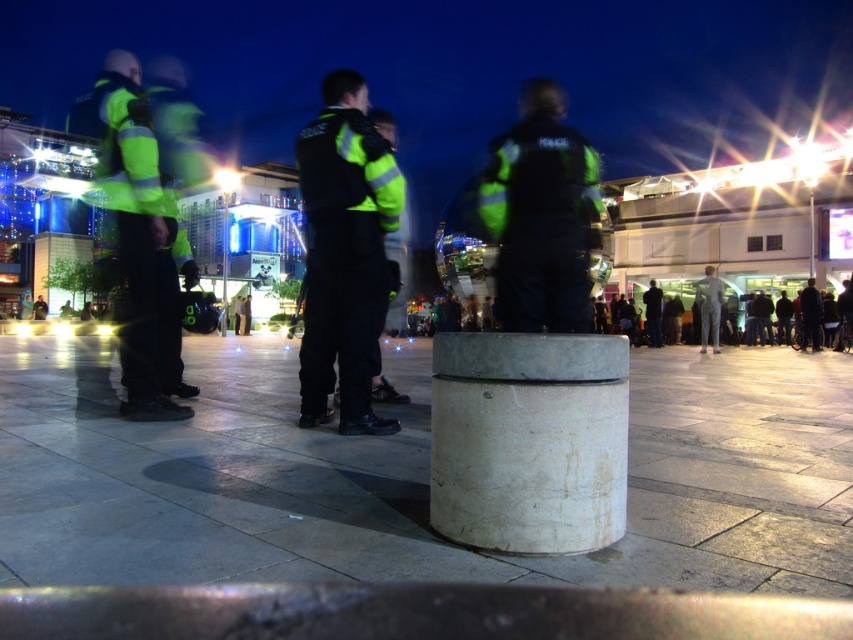
Question: Can you confirm if white marble pillar at center is positioned below high-visibility reflective jacket at left?

Choices:
 (A) yes
 (B) no

Answer: (A)

Question: From the image, what is the correct spatial relationship of high-visibility reflective jacket at center in relation to high-visibility reflective jacket at left?

Choices:
 (A) right
 (B) left

Answer: (A)

Question: Which of the following is the farthest from the observer?

Choices:
 (A) (432, 509)
 (B) (132, 289)
 (C) (315, 248)
 (D) (529, 84)

Answer: (D)

Question: Which object is closer to the camera taking this photo?

Choices:
 (A) white marble pillar at center
 (B) green reflective jacket at center
 (C) high-visibility reflective jacket at left

Answer: (A)

Question: Is white marble pillar at center to the left of green reflective jacket at center from the viewer's perspective?

Choices:
 (A) yes
 (B) no

Answer: (A)

Question: Among these objects, which one is nearest to the camera?

Choices:
 (A) high-visibility reflective jacket at left
 (B) white marble pillar at center
 (C) high-visibility reflective jacket at center

Answer: (B)